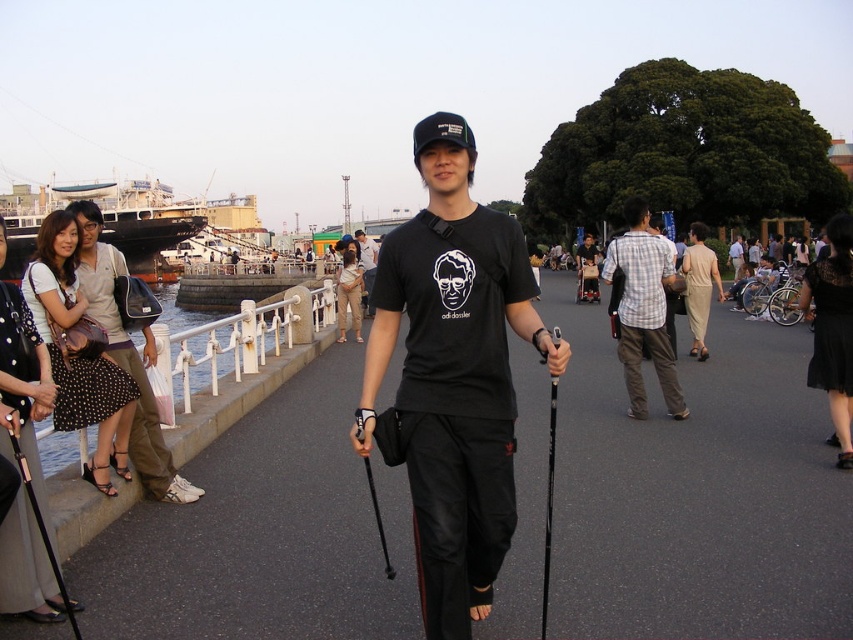
Is black matte t-shirt at center smaller than black plastic ski pole at center?

Actually, black matte t-shirt at center might be larger than black plastic ski pole at center.

Which is in front, point (479, 445) or point (370, 476)?

Positioned in front is point (479, 445).

The width and height of the screenshot is (853, 640). Identify the location of black matte t-shirt at center. pos(451,376).

Is point (666, 248) in front of point (0, 502)?

No, (666, 248) is behind (0, 502).

This screenshot has width=853, height=640. Find the location of `plaid cotton shirt at center`. plaid cotton shirt at center is located at coordinates (643, 308).

Which of these two, black fabric t-shirt at center or matte black t-shirt at center, stands shorter?

Standing shorter between the two is black fabric t-shirt at center.

Is black fabric t-shirt at center shorter than matte black t-shirt at center?

Correct, black fabric t-shirt at center is not as tall as matte black t-shirt at center.

You are a GUI agent. You are given a task and a screenshot of the screen. Output one action in this format:
    pyautogui.click(x=<x>, y=<y>)
    Task: Click on the black fabric t-shirt at center
    The width and height of the screenshot is (853, 640).
    Given the screenshot: What is the action you would take?
    pyautogui.click(x=697, y=493)